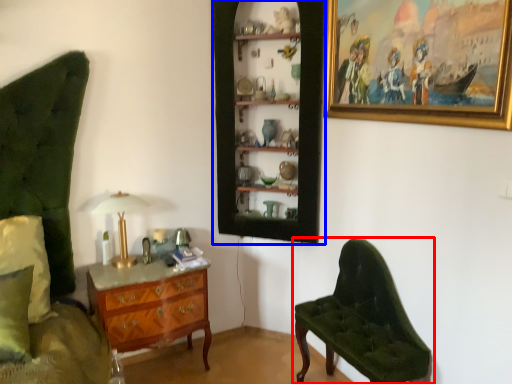
Question: Which point is closer to the camera, chair (highlighted by a red box) or shelf (highlighted by a blue box)?

Choices:
 (A) chair
 (B) shelf

Answer: (A)